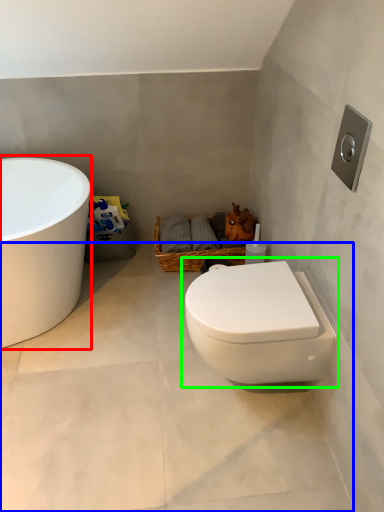
Question: Estimate the real-world distances between objects in this image. Which object is farther from bathtub (highlighted by a red box), concrete (highlighted by a blue box) or toilet (highlighted by a green box)?

Choices:
 (A) concrete
 (B) toilet

Answer: (B)